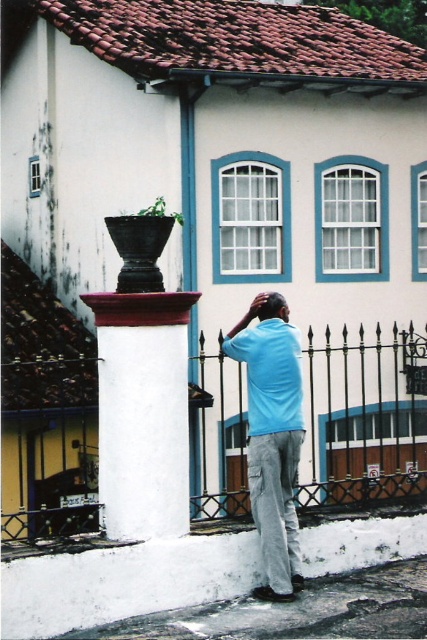
Does iron/glossy fence at center have a greater width compared to white painted stone column at center?

Correct, the width of iron/glossy fence at center exceeds that of white painted stone column at center.

Which is in front, point (199, 493) or point (123, 326)?

Point (123, 326) is more forward.

This screenshot has height=640, width=427. What are the coordinates of `iron/glossy fence at center` in the screenshot? It's located at (365, 419).

Does iron/glossy fence at center appear on the left side of light blue cotton shirt at center?

Incorrect, iron/glossy fence at center is not on the left side of light blue cotton shirt at center.

Based on the photo, can you confirm if iron/glossy fence at center is smaller than light blue cotton shirt at center?

Indeed, iron/glossy fence at center has a smaller size compared to light blue cotton shirt at center.

Who is more distant from viewer, (x=192, y=444) or (x=263, y=436)?

The point (x=192, y=444) is more distant.

At what (x,y) coordinates should I click in order to perform the action: click on iron/glossy fence at center. Please return your answer as a coordinate pair (x, y). The image size is (427, 640). Looking at the image, I should click on (365, 419).

The width and height of the screenshot is (427, 640). Describe the element at coordinates (143, 412) in the screenshot. I see `white painted stone column at center` at that location.

Can you confirm if white painted stone column at center is positioned to the left of light blue cotton shirt at center?

Yes, white painted stone column at center is to the left of light blue cotton shirt at center.

At what (x,y) coordinates should I click in order to perform the action: click on white painted stone column at center. Please return your answer as a coordinate pair (x, y). The height and width of the screenshot is (640, 427). Looking at the image, I should click on (143, 412).

In order to click on white painted stone column at center in this screenshot , I will do `click(143, 412)`.